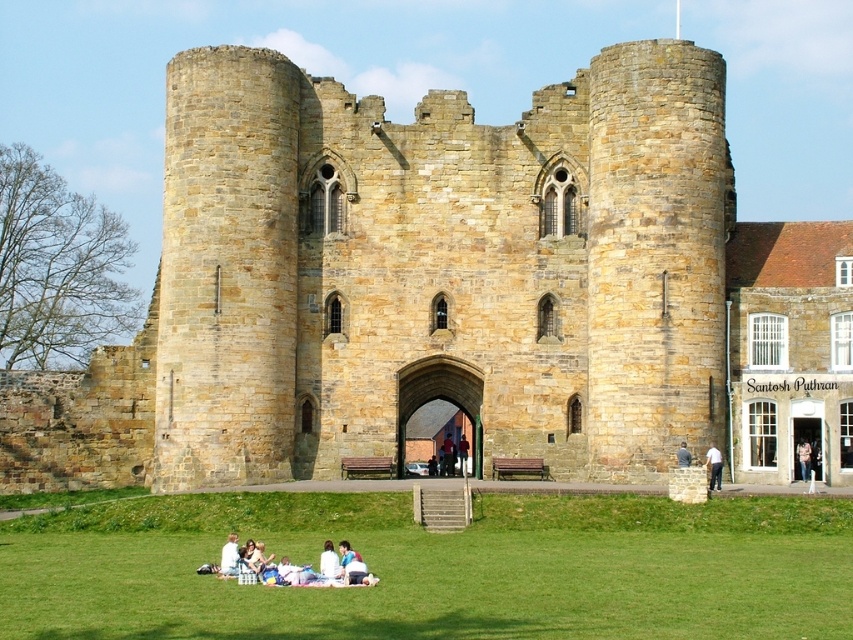
Question: Does green grass at lower center appear over red shirt at center?

Choices:
 (A) no
 (B) yes

Answer: (A)

Question: Which point is closer to the camera?

Choices:
 (A) light brown stone wall at center
 (B) light brown hair at lower center
 (C) dark gray stone person at center
 (D) green grass at lower center

Answer: (D)

Question: Does green grass at lower center appear over dark gray stone person at center?

Choices:
 (A) yes
 (B) no

Answer: (B)

Question: Which of the following is the farthest from the observer?

Choices:
 (A) light blue fabric at lower center
 (B) light brown leather jacket at center
 (C) green grass at lower center

Answer: (B)

Question: Among these objects, which one is nearest to the camera?

Choices:
 (A) white cotton picnic blanket at lower center
 (B) red shirt at center

Answer: (A)

Question: Does light blue fabric at lower center lie behind light brown stone wall at center?

Choices:
 (A) yes
 (B) no

Answer: (B)